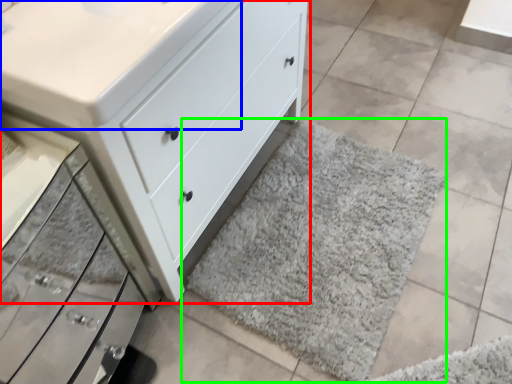
Question: Which object is positioned farthest from chest of drawers (highlighted by a red box)? Select from counter top (highlighted by a blue box) and bath mat (highlighted by a green box).

Choices:
 (A) counter top
 (B) bath mat

Answer: (B)